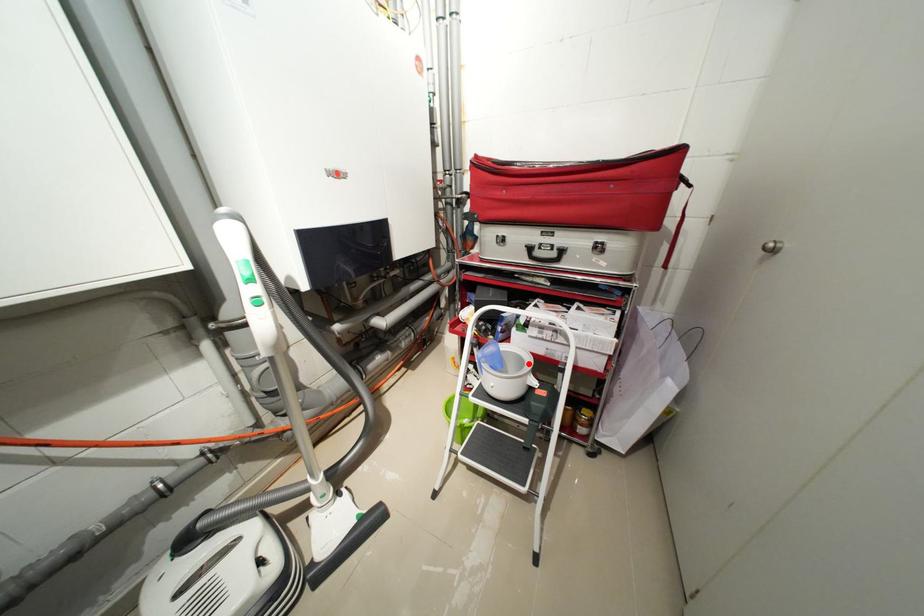
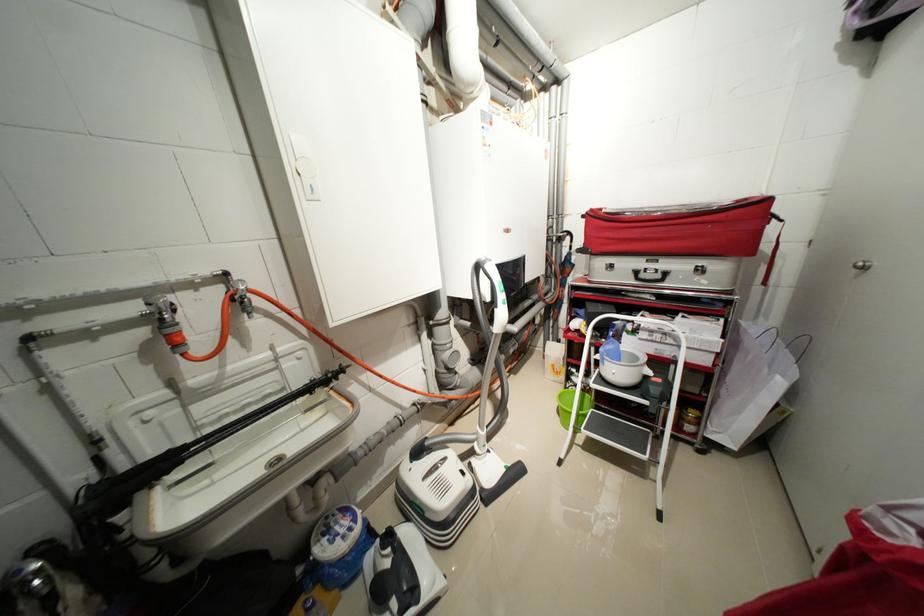
In the second image, find the point that corresponds to the highlighted location in the first image.

(642, 359)